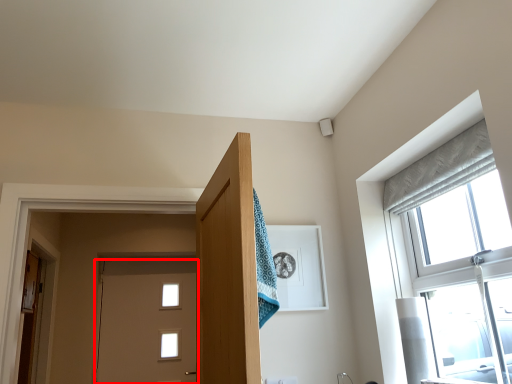
Question: Considering the relative positions of door (annotated by the red box) and door in the image provided, where is door (annotated by the red box) located with respect to the staircase?

Choices:
 (A) left
 (B) right

Answer: (B)